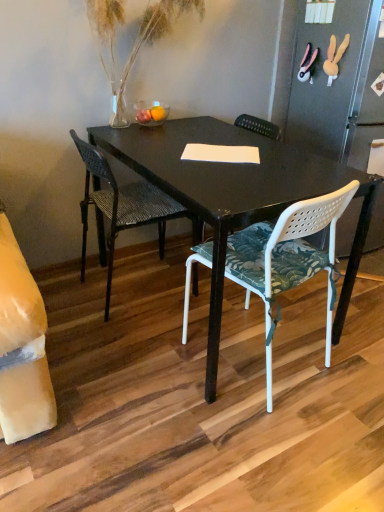
Question: In the image, is white plastic chair with floral cushion at center, which appears as the 1th chair when viewed from the right, positioned in front of or behind black woven chair at center, placed as the 1th chair when sorted from left to right?

Choices:
 (A) behind
 (B) front

Answer: (B)

Question: Based on their sizes in the image, would you say white plastic chair with floral cushion at center, which appears as the 1th chair when viewed from the right, is bigger or smaller than black woven chair at center, the 2th chair viewed from the right?

Choices:
 (A) small
 (B) big

Answer: (B)

Question: Would you say white plastic chair with floral cushion at center, which appears as the 1th chair when viewed from the right, is inside or outside black woven chair at center, the 2th chair viewed from the right?

Choices:
 (A) inside
 (B) outside

Answer: (B)

Question: Considering the positions of black woven chair at center, placed as the 1th chair when sorted from left to right, and white plastic chair with floral cushion at center, which appears as the 1th chair when viewed from the right, in the image, is black woven chair at center, placed as the 1th chair when sorted from left to right, bigger or smaller than white plastic chair with floral cushion at center, which appears as the 1th chair when viewed from the right,?

Choices:
 (A) small
 (B) big

Answer: (A)

Question: From a real-world perspective, is black woven chair at center, placed as the 1th chair when sorted from left to right, physically located above or below white plastic chair with floral cushion at center, which ranks as the second chair in left-to-right order?

Choices:
 (A) above
 (B) below

Answer: (B)

Question: From the image's perspective, is black woven chair at center, placed as the 1th chair when sorted from left to right, located above or below white plastic chair with floral cushion at center, which appears as the 1th chair when viewed from the right?

Choices:
 (A) above
 (B) below

Answer: (A)

Question: In terms of height, does black woven chair at center, placed as the 1th chair when sorted from left to right, look taller or shorter compared to white plastic chair with floral cushion at center, which appears as the 1th chair when viewed from the right?

Choices:
 (A) short
 (B) tall

Answer: (B)